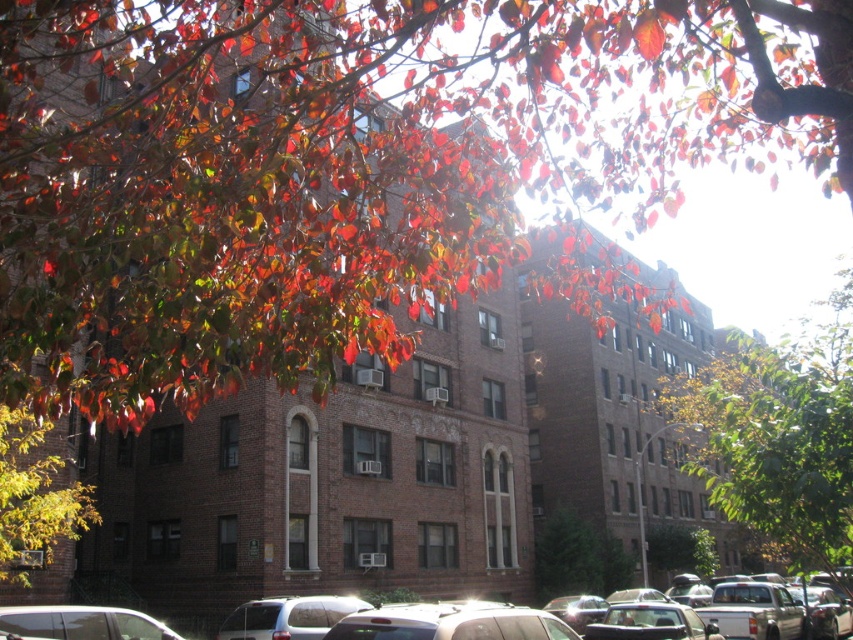
You are a photographer trying to capture the shiny red leaves at upper center and the matte silver suv at lower center in the same frame. Which object will occupy more space in your photo?

The shiny red leaves at upper center will occupy more space in the photo because their width is larger than the matte silver suv at lower center.

You are an artist sketching the apartment building and notice two sets of leaves in the scene. Which set of leaves, the shiny red leaves at upper center or the shiny green leaves at lower left, is positioned to the right of the other?

The shiny red leaves at upper center are positioned to the right of the shiny green leaves at lower left.

Looking at this image, you are a photographer trying to capture the shiny red leaves at upper center and the matte silver suv at lower center in a single frame. Based on their sizes, which object would appear more prominent in the photo?

The shiny red leaves at upper center would appear more prominent in the photo because they are larger in size than the matte silver suv at lower center.